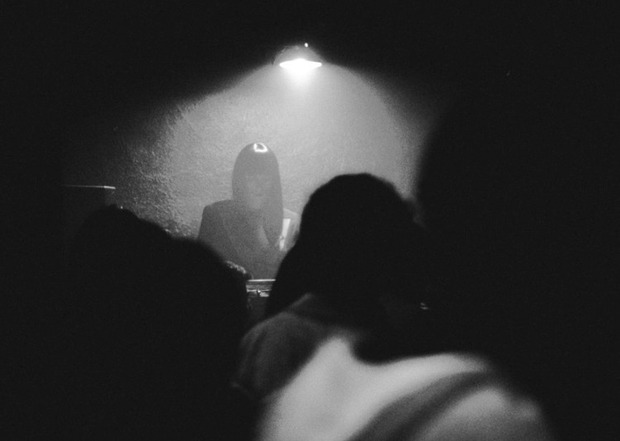
Find the location of a particular element. This screenshot has height=441, width=620. white ceiling light is located at coordinates (281, 47).